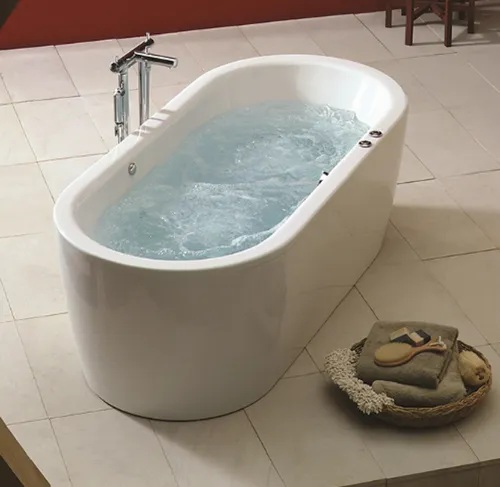
This screenshot has height=487, width=500. In order to click on buttons on bath in this screenshot , I will do `click(376, 130)`, `click(366, 148)`.